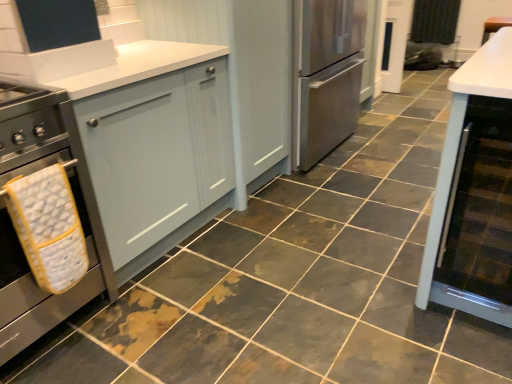
Find the location of a particular element. This screenshot has width=512, height=384. vacant space in front of matte glass cabinet at right, which is the third cabinetry in left-to-right order is located at coordinates (473, 357).